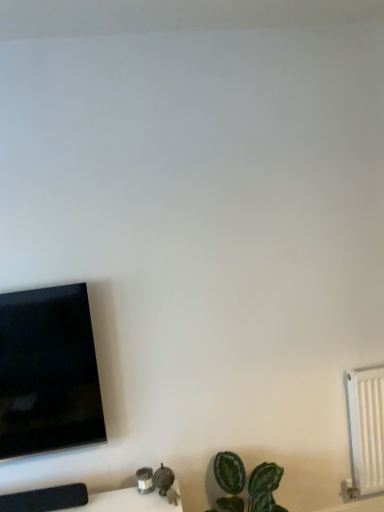
Question: Looking at their shapes, would you say white plastic radiator at right is wider or thinner than black glossy tv at left?

Choices:
 (A) thin
 (B) wide

Answer: (A)

Question: From the image's perspective, is white plastic radiator at right positioned above or below black glossy tv at left?

Choices:
 (A) above
 (B) below

Answer: (B)

Question: Relative to black glossy tv at left, is white plastic radiator at right in front or behind?

Choices:
 (A) front
 (B) behind

Answer: (B)

Question: Considering the positions of black glossy tv at left and white plastic radiator at right in the image, is black glossy tv at left taller or shorter than white plastic radiator at right?

Choices:
 (A) tall
 (B) short

Answer: (A)

Question: Is black glossy tv at left situated inside white plastic radiator at right or outside?

Choices:
 (A) outside
 (B) inside

Answer: (A)

Question: Visually, is black glossy tv at left positioned to the left or to the right of white plastic radiator at right?

Choices:
 (A) left
 (B) right

Answer: (A)

Question: Considering their positions, is black glossy tv at left located in front of or behind white plastic radiator at right?

Choices:
 (A) behind
 (B) front

Answer: (B)